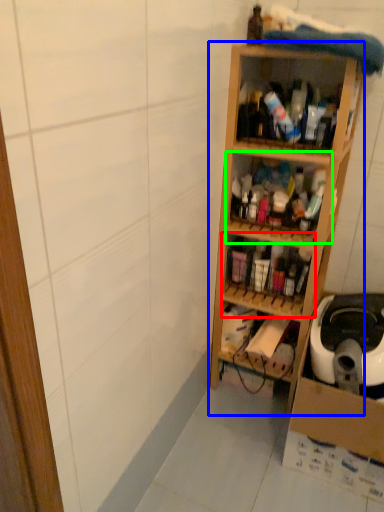
Question: Which object is positioned closest to shelf (highlighted by a red box)? Select from shelf (highlighted by a blue box) and shelf (highlighted by a green box).

Choices:
 (A) shelf
 (B) shelf

Answer: (A)